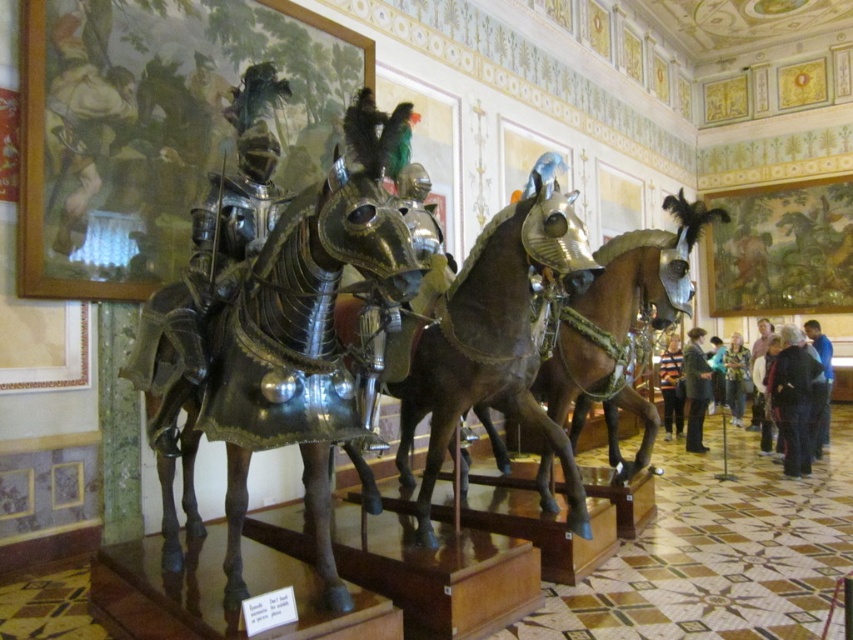
You are a visitor standing in the museum and see the dark blue shirt at lower right and the pink fabric at lower right. Which one is more to the left?

The dark blue shirt at lower right is more to the left.

You are a visitor at the museum and want to take a photo of the shiny brown horse at center and the dark blue shirt at lower right. Which object should you focus on first if you want to capture both in one frame without moving the camera?

You should focus on the shiny brown horse at center first because it is wider than the dark blue shirt at lower right, ensuring it fits properly in the frame.